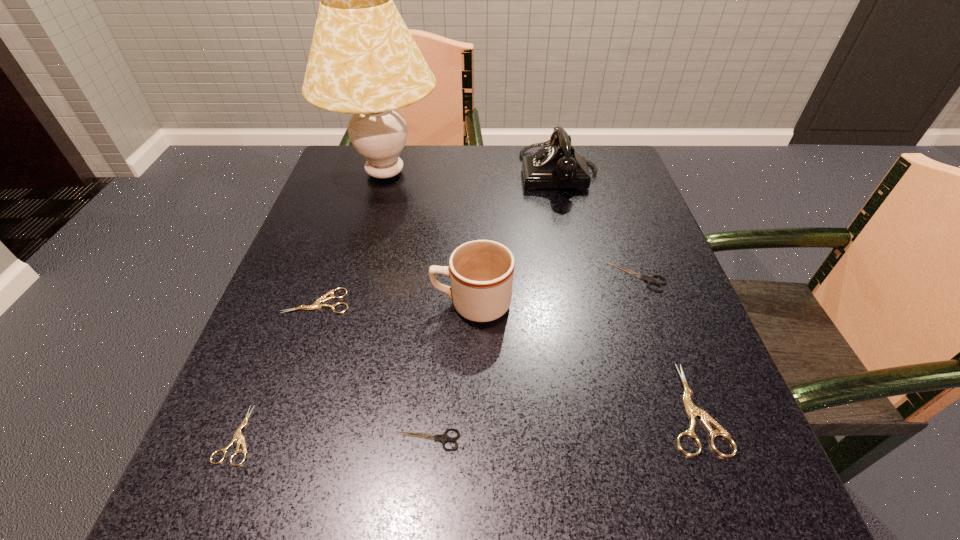
Image resolution: width=960 pixels, height=540 pixels. I want to click on lampshade, so pos(363,61).

You are a GUI agent. You are given a task and a screenshot of the screen. Output one action in this format:
    pyautogui.click(x=<x>, y=<y>)
    Task: Click on the tallest object
    
    Given the screenshot: What is the action you would take?
    click(363, 61)

The width and height of the screenshot is (960, 540). In order to click on black telephone in this screenshot , I will do `click(558, 165)`.

Where is `mug`? The height and width of the screenshot is (540, 960). mug is located at coordinates pos(481,272).

At what (x,y) coordinates should I click in order to perform the action: click on the bigger black shears. Please return your answer as a coordinate pair (x, y). The image size is (960, 540). Looking at the image, I should click on (649, 279).

This screenshot has width=960, height=540. In order to click on the right black shears in this screenshot , I will do `click(649, 279)`.

Where is `the biggest beige shears`? The height and width of the screenshot is (540, 960). the biggest beige shears is located at coordinates (692, 410).

Find the location of a particular element. The image size is (960, 540). the farthest beige shears is located at coordinates (316, 305).

The image size is (960, 540). Identify the location of the third shears from left to right. (443, 438).

You are a GUI agent. You are given a task and a screenshot of the screen. Output one action in this format:
    pyautogui.click(x=<x>, y=<y>)
    Task: Click on the smaller black shears
    
    Given the screenshot: What is the action you would take?
    coord(443,438)